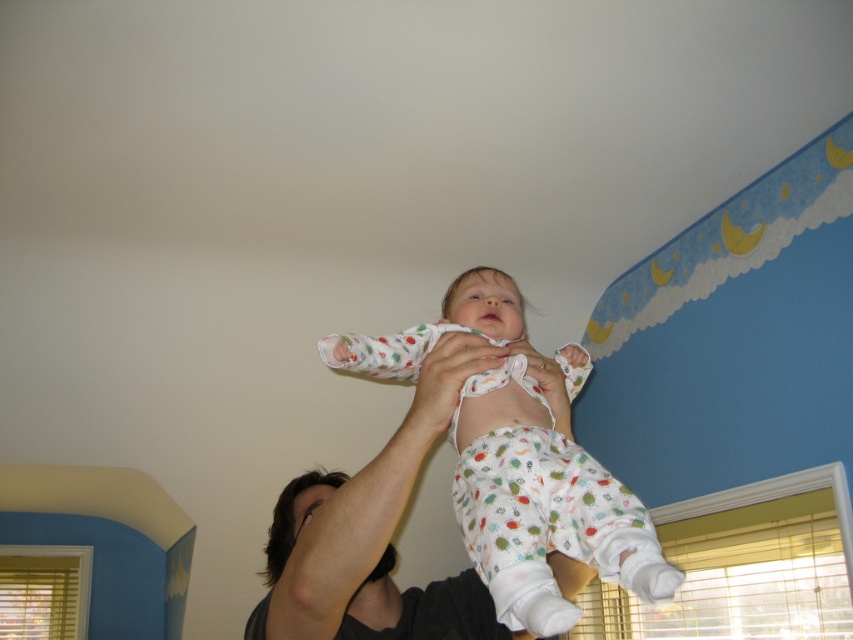
Question: Is white cotton onesie at center bigger than smooth skin arm at upper center?

Choices:
 (A) yes
 (B) no

Answer: (A)

Question: Which point is closer to the camera taking this photo?

Choices:
 (A) (328, 604)
 (B) (495, 296)

Answer: (A)

Question: Is white cotton onesie at center thinner than smooth skin arm at upper center?

Choices:
 (A) no
 (B) yes

Answer: (A)

Question: Which point appears farthest from the camera in this image?

Choices:
 (A) (306, 525)
 (B) (492, 593)

Answer: (A)

Question: Does white cotton onesie at center have a larger size compared to smooth skin arm at upper center?

Choices:
 (A) yes
 (B) no

Answer: (A)